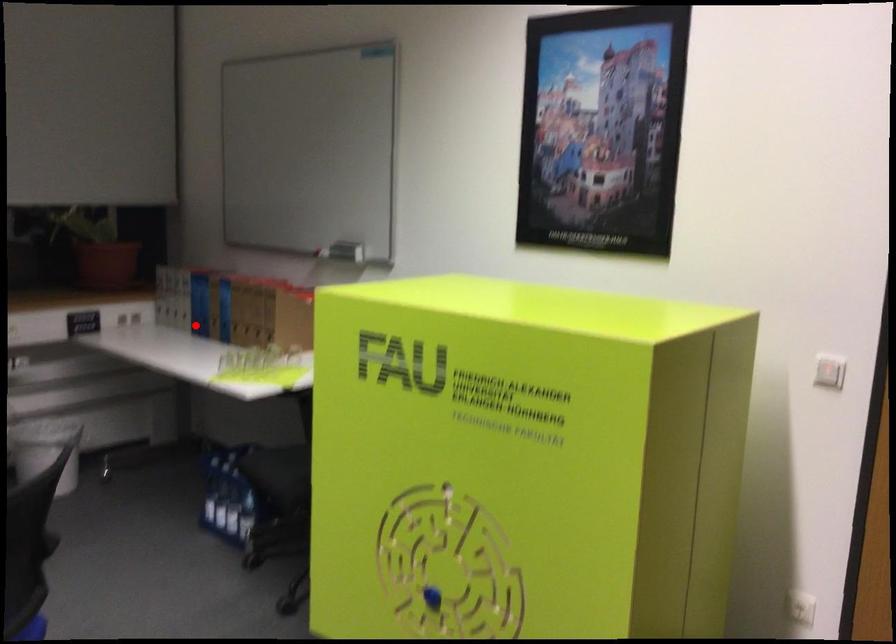
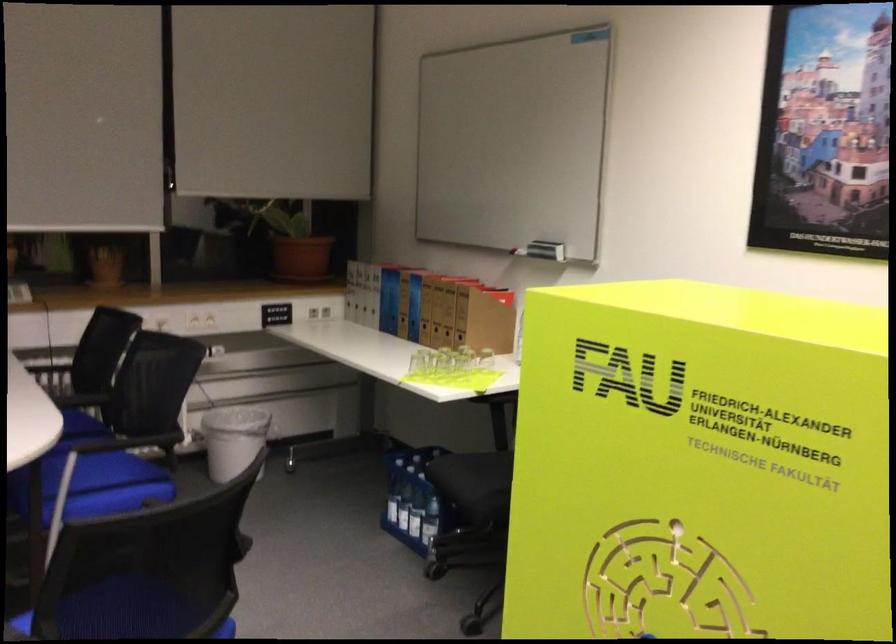
Locate, in the second image, the point that corresponds to the highlighted location in the first image.

(382, 321)